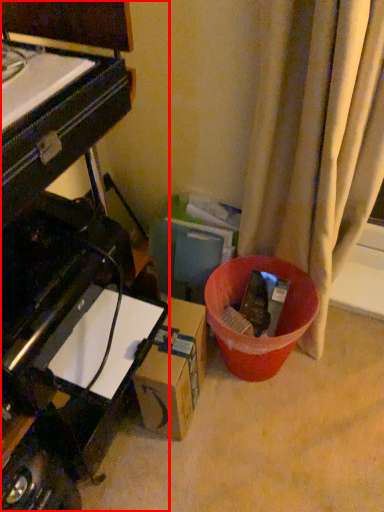
Question: From the image's perspective, considering the relative positions of piano (annotated by the red box) and cardboard box in the image provided, where is piano (annotated by the red box) located with respect to the staircase?

Choices:
 (A) above
 (B) below

Answer: (A)